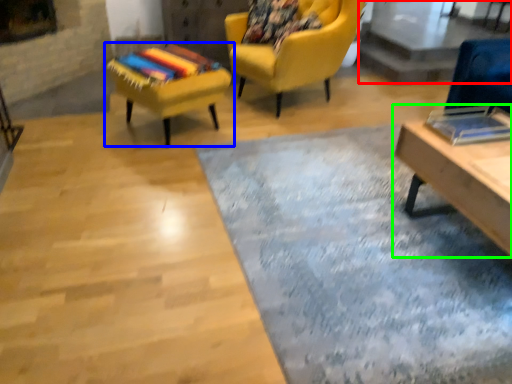
Question: Considering the real-world distances, which object is farthest from glass table (highlighted by a red box)? chair (highlighted by a blue box) or table (highlighted by a green box)?

Choices:
 (A) chair
 (B) table

Answer: (A)